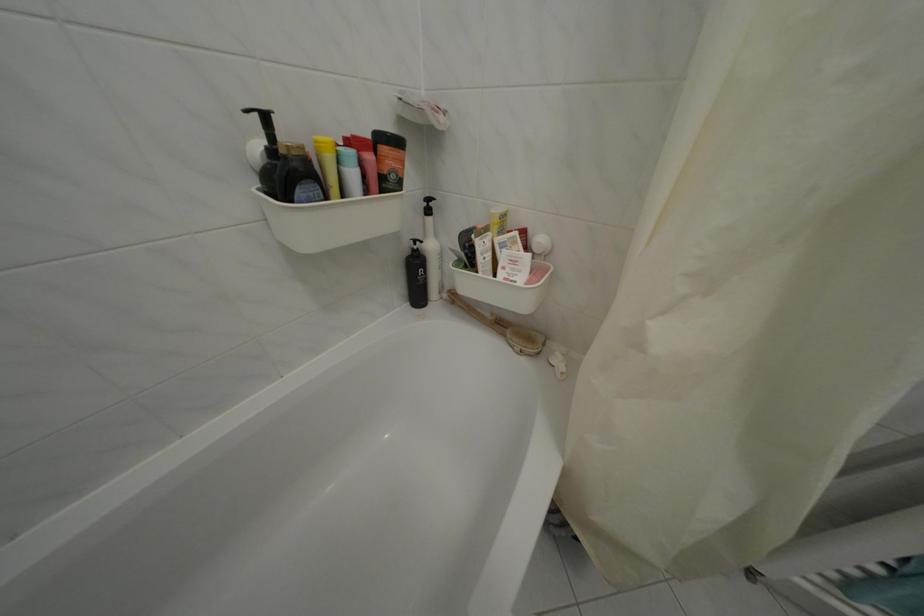
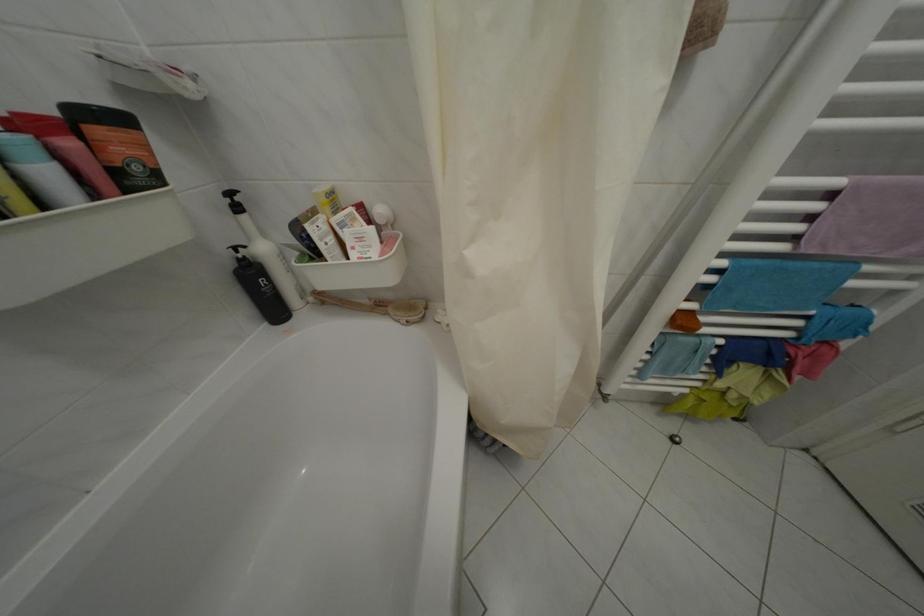
Find the pixel in the second image that matches point (502, 321) in the first image.

(379, 306)